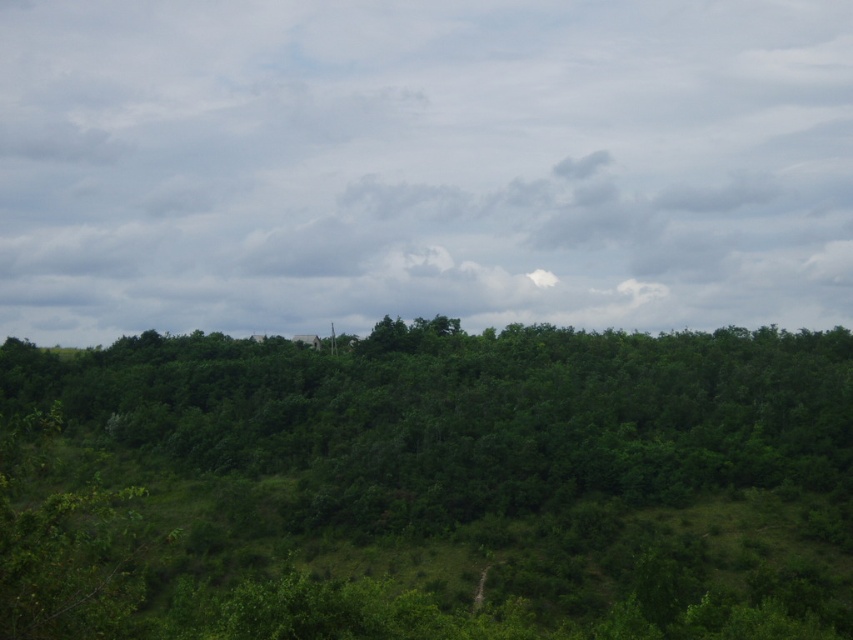
You are an environmental scientist studying the landscape. You need to determine the vertical distance between the cloudy sky at upper center and the green leafy forest at center. Based on the scene, what is the approximate distance in meters?

The cloudy sky at upper center and the green leafy forest at center are 339.86 meters apart.

You are standing in the lush green landscape and want to take a photo. You notice two points in the scene at coordinates point (x=90, y=92) and point (x=770, y=570). Which point is closer to your camera lens?

Point (x=90, y=92) is further to the camera than point (x=770, y=570), so the point closer to your camera lens is point (x=770, y=570).